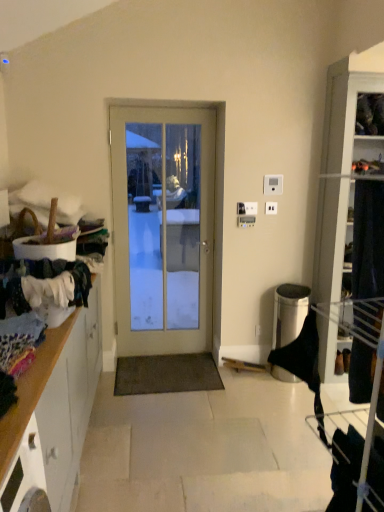
In order to face white plastic light switch at upper center, the 2th light switch ordered from the bottom, should I rotate leftwards or rightwards?

Rotate right and turn 10.903 degrees.

Where is `white plastic light switch at upper center, placed as the 2th light switch when sorted from right to left`? This screenshot has height=512, width=384. white plastic light switch at upper center, placed as the 2th light switch when sorted from right to left is located at coordinates (251, 208).

What do you see at coordinates (251, 208) in the screenshot? Image resolution: width=384 pixels, height=512 pixels. I see `white plastic light switch at upper center, marked as the 1th light switch in a bottom-to-top arrangement` at bounding box center [251, 208].

At what (x,y) coordinates should I click in order to perform the action: click on white glass door at center. Please return your answer as a coordinate pair (x, y). Looking at the image, I should click on [163, 222].

From the image's perspective, is wooden cabinet at left positioned above or below white glass door at center?

From the image's perspective, wooden cabinet at left appears below white glass door at center.

Can you confirm if wooden cabinet at left is taller than white glass door at center?

In fact, wooden cabinet at left may be shorter than white glass door at center.

Locate an element on the screen. The image size is (384, 512). door that is above the wooden cabinet at left (from a real-world perspective) is located at coordinates (163, 222).

Between white plastic light switch at upper center, placed as the first light switch when sorted from top to bottom, and wooden cabinet at left, which one appears on the right side from the viewer's perspective?

white plastic light switch at upper center, placed as the first light switch when sorted from top to bottom, is more to the right.

Which object is closer to the camera, white plastic light switch at upper center, acting as the first light switch starting from the right, or wooden cabinet at left?

wooden cabinet at left is in front.

From the wooden cabinet at left, count 2nd light switch to the right and point to it. Please provide its 2D coordinates.

[(273, 185)]

In terms of size, does white plastic electric outlet at center appear bigger or smaller than white plastic light switch at upper center, the 2th light switch ordered from the bottom?

Considering their sizes, white plastic electric outlet at center takes up less space than white plastic light switch at upper center, the 2th light switch ordered from the bottom.

Measure the distance from white plastic electric outlet at center to white plastic light switch at upper center, which is the 2th light switch in left-to-right order.

white plastic electric outlet at center and white plastic light switch at upper center, which is the 2th light switch in left-to-right order, are 4.95 inches apart from each other.

Which light switch is the 2nd one when counting from the front of the white plastic electric outlet at center? Please provide its 2D coordinates.

[(273, 185)]

Is white plastic electric outlet at center behind white plastic light switch at upper center, acting as the first light switch starting from the right?

Yes.

Is white glass door at center taller or shorter than wooden cabinet at left?

white glass door at center is taller than wooden cabinet at left.

From the picture: From the image's perspective, is white glass door at center located above or below wooden cabinet at left?

Based on their image positions, white glass door at center is located above wooden cabinet at left.

Looking at the image, does white glass door at center seem bigger or smaller compared to wooden cabinet at left?

Clearly, white glass door at center is smaller in size than wooden cabinet at left.

From the image's perspective, which one is positioned higher, white plastic light switch at upper center, the 2th light switch positioned from the top, or white glass door at center?

From the image's view, white plastic light switch at upper center, the 2th light switch positioned from the top, is above.

Considering the positions of objects white plastic light switch at upper center, which appears as the 1th light switch when viewed from the left, and white glass door at center in the image provided, who is more to the right, white plastic light switch at upper center, which appears as the 1th light switch when viewed from the left, or white glass door at center?

white plastic light switch at upper center, which appears as the 1th light switch when viewed from the left.

Is point (250, 205) closer to camera compared to point (133, 253)?

Yes, point (250, 205) is closer to viewer.

Looking at this image, can you see white plastic light switch at upper center, marked as the 1th light switch in a bottom-to-top arrangement, touching white glass door at center?

No, white plastic light switch at upper center, marked as the 1th light switch in a bottom-to-top arrangement, is not touching white glass door at center.

Does point (272, 189) lie in front of point (245, 209)?

Yes, point (272, 189) is closer to viewer.

Does white plastic light switch at upper center, placed as the first light switch when sorted from top to bottom, have a lesser width compared to white plastic light switch at upper center, which appears as the 1th light switch when viewed from the left?

Yes, white plastic light switch at upper center, placed as the first light switch when sorted from top to bottom, is thinner than white plastic light switch at upper center, which appears as the 1th light switch when viewed from the left.

Is white plastic light switch at upper center, which is the 2th light switch in left-to-right order, in front of or behind white plastic light switch at upper center, placed as the 2th light switch when sorted from right to left, in the image?

Clearly, white plastic light switch at upper center, which is the 2th light switch in left-to-right order, is in front of white plastic light switch at upper center, placed as the 2th light switch when sorted from right to left.

Is white glass door at center facing away from white plastic light switch at upper center, the 2th light switch ordered from the bottom?

No.

Find the location of a particular element. This screenshot has height=512, width=384. light switch that is the 2nd object located above the white glass door at center (from the image's perspective) is located at coordinates (273, 185).

Looking at this image, how different are the orientations of white glass door at center and white plastic light switch at upper center, placed as the first light switch when sorted from top to bottom, in degrees?

There is a 1.32-degree angle between the facing directions of white glass door at center and white plastic light switch at upper center, placed as the first light switch when sorted from top to bottom.

Considering the relative sizes of white glass door at center and white plastic light switch at upper center, placed as the first light switch when sorted from top to bottom, in the image provided, is white glass door at center smaller than white plastic light switch at upper center, placed as the first light switch when sorted from top to bottom,?

No, white glass door at center is not smaller than white plastic light switch at upper center, placed as the first light switch when sorted from top to bottom.

Identify the location of cabinetry on the left of white glass door at center. (53, 410).

From the image's perspective, starting from the wooden cabinet at left, which light switch is the 2nd one above? Please provide its 2D coordinates.

[(273, 185)]

From the image, which object appears to be nearer to wooden cabinet at left, white glass door at center or white plastic light switch at upper center, the 2th light switch positioned from the top?

white glass door at center.

Based on their spatial positions, is white plastic light switch at upper center, acting as the first light switch starting from the right, or white glass door at center further from white plastic light switch at upper center, placed as the 2th light switch when sorted from right to left?

white glass door at center lies further to white plastic light switch at upper center, placed as the 2th light switch when sorted from right to left, than the other object.

From the image, which object appears to be farther from wooden cabinet at left, white glass door at center or white plastic light switch at upper center, acting as the first light switch starting from the right?

white plastic light switch at upper center, acting as the first light switch starting from the right, is positioned further to the anchor wooden cabinet at left.

Looking at this image, considering their positions, is white glass door at center positioned closer to white plastic light switch at upper center, the 2th light switch positioned from the top, than white plastic light switch at upper center, acting as the first light switch starting from the right?

Among the two, white plastic light switch at upper center, acting as the first light switch starting from the right, is located nearer to white plastic light switch at upper center, the 2th light switch positioned from the top.

From the image, which object appears to be nearer to white plastic light switch at upper center, placed as the 2th light switch when sorted from right to left, white plastic electric outlet at center or white glass door at center?

white plastic electric outlet at center.

From the picture: Which object lies nearer to the anchor point white glass door at center, white plastic electric outlet at center or white plastic light switch at upper center, the 2th light switch ordered from the bottom?

white plastic light switch at upper center, the 2th light switch ordered from the bottom, lies closer to white glass door at center than the other object.

When comparing their distances from white glass door at center, does white plastic light switch at upper center, which is the 2th light switch in left-to-right order, or white plastic electric outlet at center seem further?

Among the two, white plastic electric outlet at center is located further to white glass door at center.

Based on their spatial positions, is white plastic electric outlet at center or white glass door at center closer to white plastic light switch at upper center, placed as the first light switch when sorted from top to bottom?

white plastic electric outlet at center lies closer to white plastic light switch at upper center, placed as the first light switch when sorted from top to bottom, than the other object.

Image resolution: width=384 pixels, height=512 pixels. In order to click on door between wooden cabinet at left and white plastic electric outlet at center from front to back in this screenshot , I will do `click(163, 222)`.

Find the location of a particular element. door located between wooden cabinet at left and white plastic light switch at upper center, the 2th light switch positioned from the top, in the depth direction is located at coordinates (163, 222).

Identify the location of door between wooden cabinet at left and white plastic light switch at upper center, placed as the first light switch when sorted from top to bottom, along the z-axis. The width and height of the screenshot is (384, 512). (163, 222).

I want to click on light switch located between white glass door at center and white plastic light switch at upper center, placed as the first light switch when sorted from top to bottom, in the left-right direction, so (x=251, y=208).